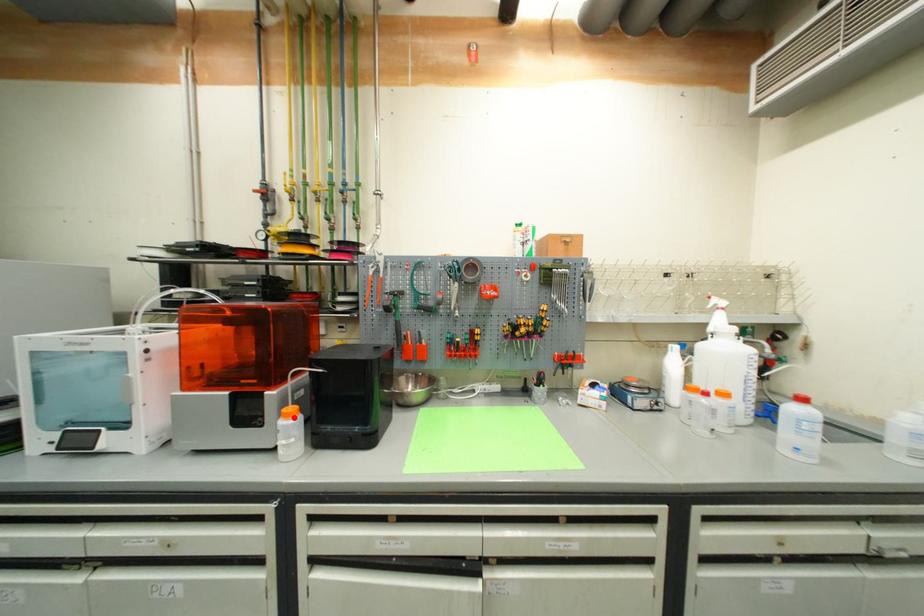
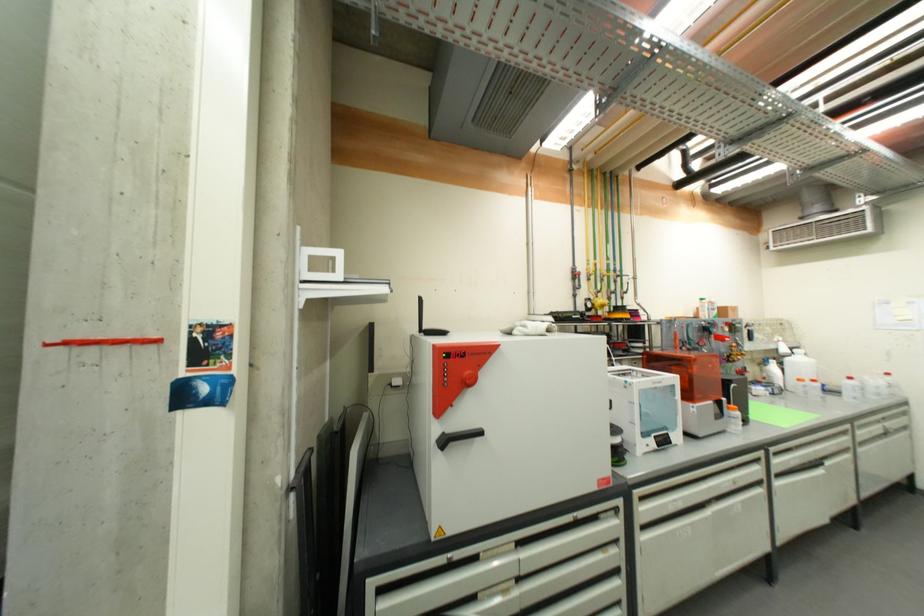
In the second image, find the point that corresponds to the highlighted location in the first image.

(739, 411)